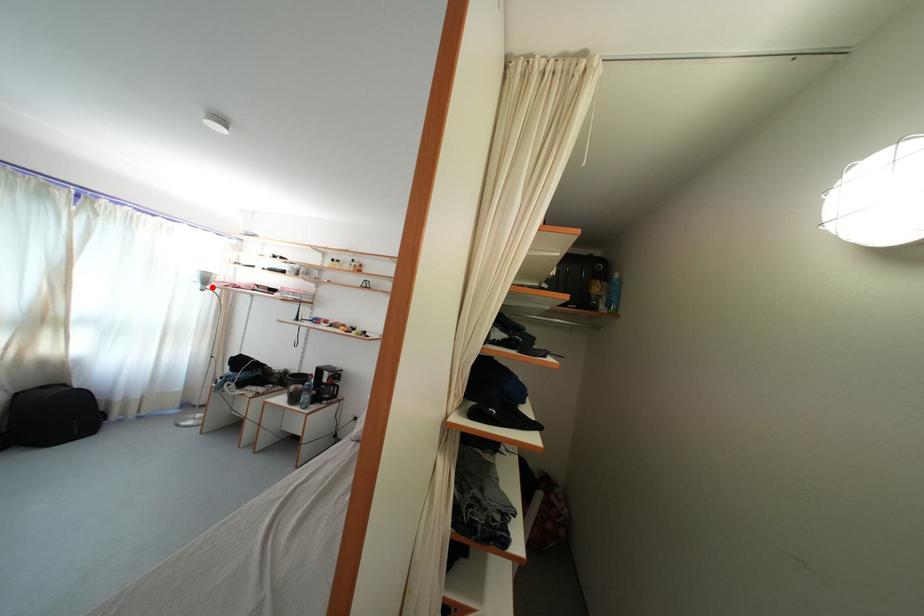
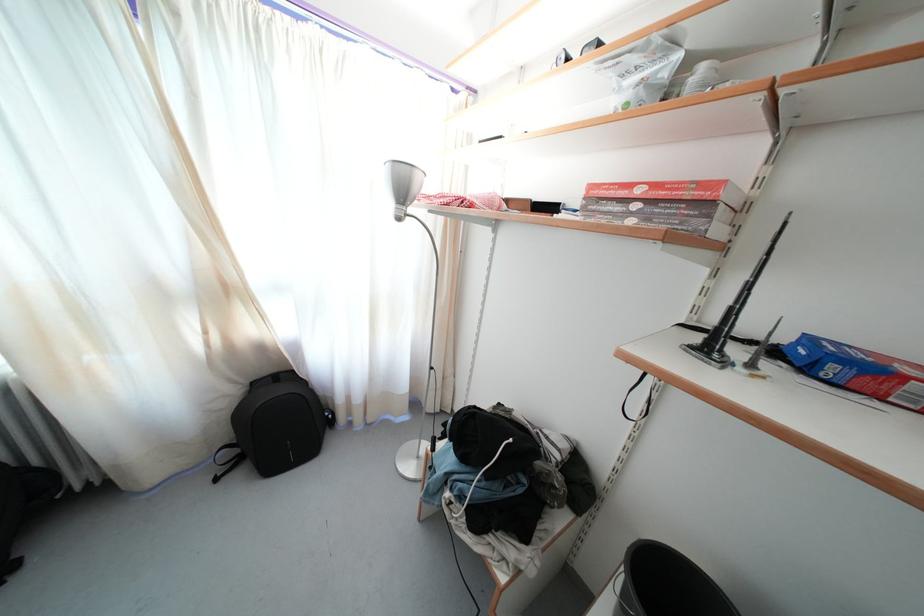
In the second image, find the point that corresponds to the highlighted location in the first image.

(408, 199)